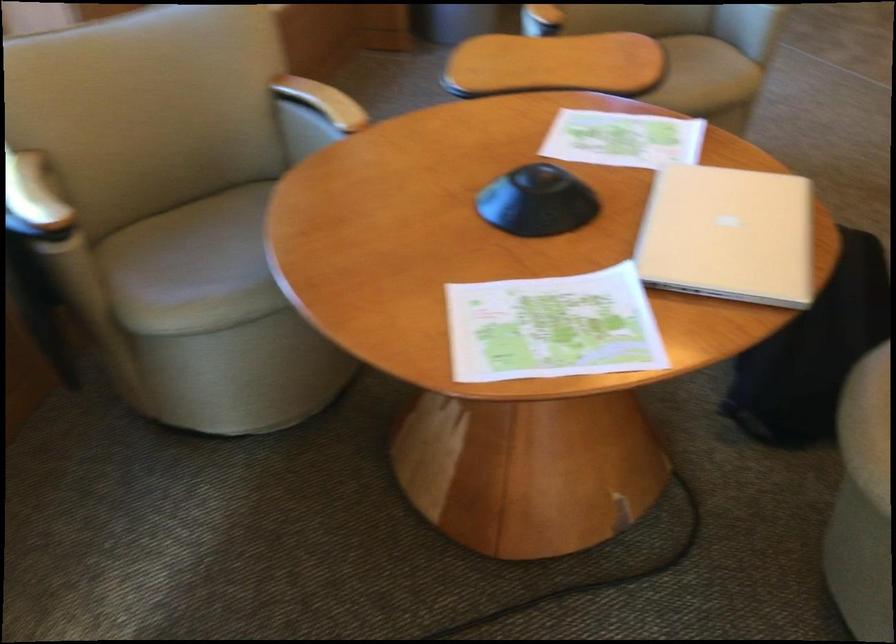
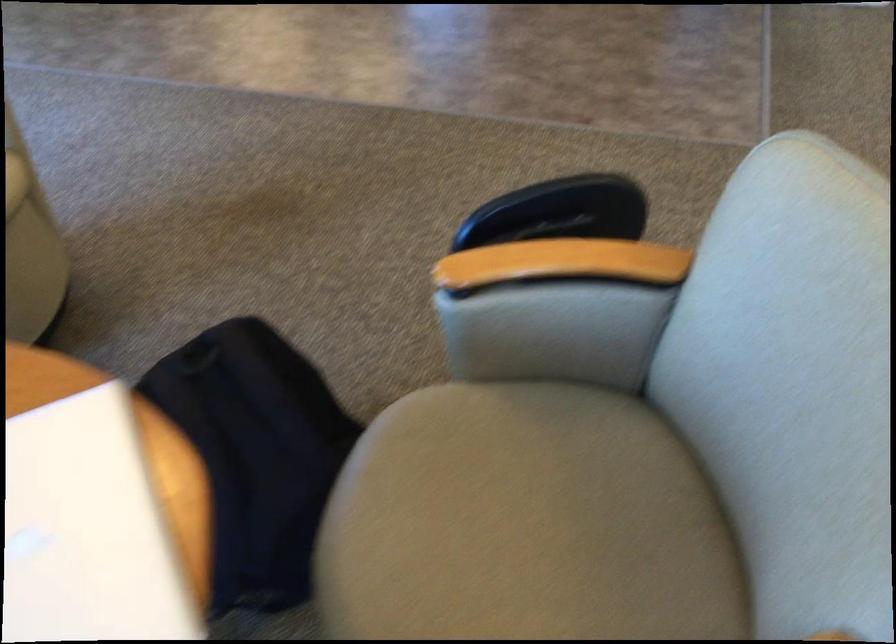
Question: The camera is either moving clockwise (left) or counter-clockwise (right) around the object. The first image is from the beginning of the video and the second image is from the end. Is the camera moving left or right when shooting the video?

Choices:
 (A) Left
 (B) Right

Answer: (A)